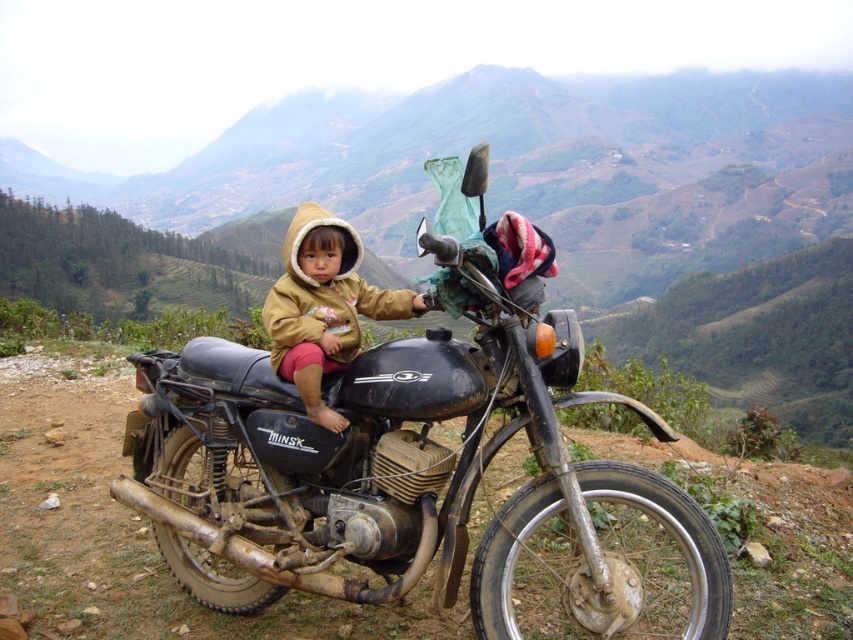
Who is more distant from viewer, (339, 595) or (306, 289)?

Positioned behind is point (306, 289).

The height and width of the screenshot is (640, 853). What do you see at coordinates (409, 461) in the screenshot?
I see `black matte motorcycle at center` at bounding box center [409, 461].

Which is behind, point (405, 420) or point (335, 246)?

Positioned behind is point (335, 246).

Locate an element on the screen. black matte motorcycle at center is located at coordinates (409, 461).